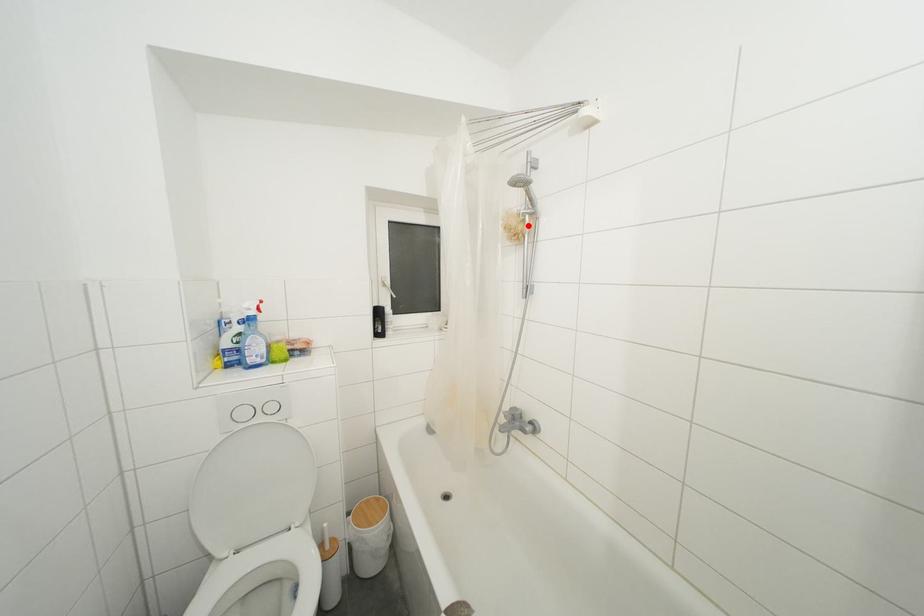
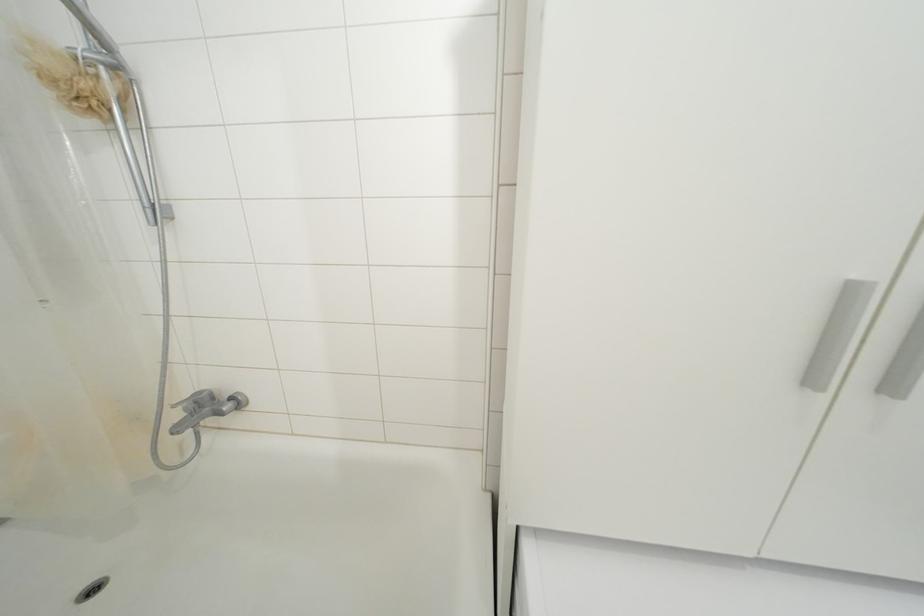
Question: I am providing you with two images of the same scene from different viewpoints. A red point is shown in image1. For the corresponding object point in image2, is it positioned nearer or farther from the camera?

Choices:
 (A) Nearer
 (B) Farther

Answer: (B)